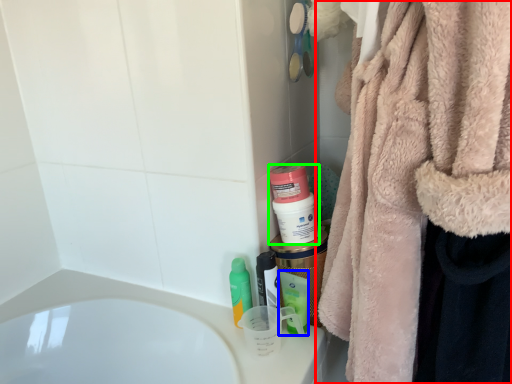
Question: Based on their relative distances, which object is nearer to towel (highlighted by a red box)? Choose from mouthwash (highlighted by a blue box) and mouthwash (highlighted by a green box).

Choices:
 (A) mouthwash
 (B) mouthwash

Answer: (B)